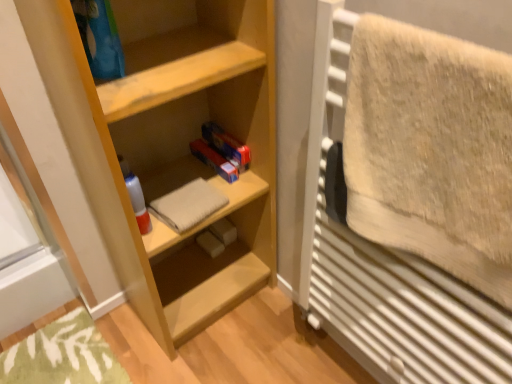
Question: From their relative heights in the image, would you say beige fluffy towel at right, which ranks as the 1th bath towel in front-to-back order, is taller or shorter than light wood shelf at center?

Choices:
 (A) short
 (B) tall

Answer: (A)

Question: From a real-world perspective, is beige fluffy towel at right, which appears as the second bath towel when viewed from the left, above or below light wood shelf at center?

Choices:
 (A) below
 (B) above

Answer: (B)

Question: Which object is positioned closest to the beige cotton towel at center, acting as the 2th bath towel starting from the front?

Choices:
 (A) beige fluffy towel at right, which appears as the second bath towel when viewed from the left
 (B) light wood shelf at center

Answer: (B)

Question: Based on their relative distances, which object is nearer to the beige fluffy towel at right, which ranks as the 1th bath towel in front-to-back order?

Choices:
 (A) light wood shelf at center
 (B) beige cotton towel at center, the 2th bath towel viewed from the right

Answer: (A)